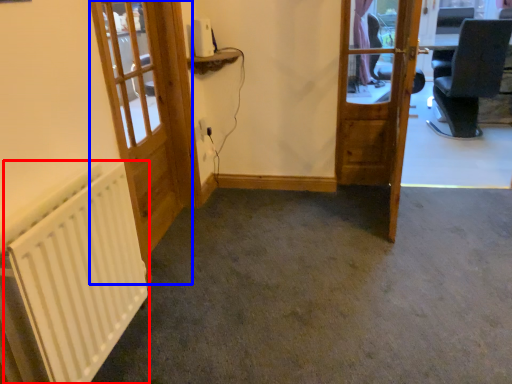
Question: Which object is closer to the camera taking this photo, radiator (highlighted by a red box) or door (highlighted by a blue box)?

Choices:
 (A) radiator
 (B) door

Answer: (A)